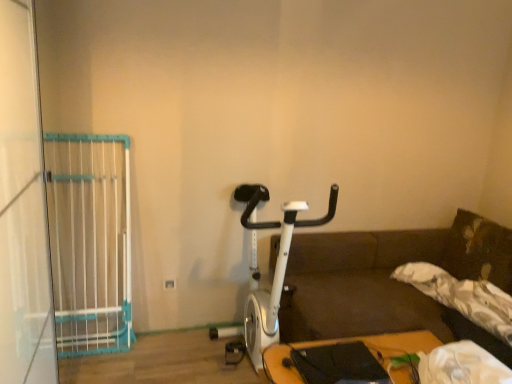
Identify the location of wooden table at lower right. This screenshot has width=512, height=384. (351, 342).

Describe the element at coordinates (90, 241) in the screenshot. I see `white plastic gate at left` at that location.

Identify the location of wooden table at lower right. The height and width of the screenshot is (384, 512). point(351,342).

Is wooden table at lower right to the left or to the right of white metallic stationary bicycle at center in the image?

wooden table at lower right is positioned on white metallic stationary bicycle at center's right side.

Is white metallic stationary bicycle at center completely or partially inside wooden table at lower right?

Definitely not — white metallic stationary bicycle at center is not inside wooden table at lower right.

From the image's perspective, is wooden table at lower right positioned above or below white metallic stationary bicycle at center?

wooden table at lower right is below white metallic stationary bicycle at center.

Between wooden table at lower right and white metallic stationary bicycle at center, which one has smaller width?

With smaller width is white metallic stationary bicycle at center.

Looking at this image, what's the angular difference between white plastic gate at left and white metallic stationary bicycle at center's facing directions?

white plastic gate at left and white metallic stationary bicycle at center are facing 0.925 degrees away from each other.

From a real-world perspective, is white plastic gate at left physically below white metallic stationary bicycle at center?

No, from a real-world perspective, white plastic gate at left is not below white metallic stationary bicycle at center.

Is white plastic gate at left oriented away from white metallic stationary bicycle at center?

No, white metallic stationary bicycle at center is not at the back of white plastic gate at left.

Is white plastic gate at left thinner than white metallic stationary bicycle at center?

Yes.

Does white plastic gate at left have a smaller size compared to wooden table at lower right?

No.

Is white plastic gate at left to the left or to the right of wooden table at lower right in the image?

white plastic gate at left is to the left of wooden table at lower right.

Does white plastic gate at left come behind wooden table at lower right?

No, the depth of white plastic gate at left is less than that of wooden table at lower right.

From a real-world perspective, is wooden table at lower right positioned over white plastic gate at left based on gravity?

No, from a real-world perspective, wooden table at lower right is not over white plastic gate at left

Between wooden table at lower right and white plastic gate at left, which one has larger width?

wooden table at lower right.

From the image's perspective, is wooden table at lower right above or below white plastic gate at left?

Based on their image positions, wooden table at lower right is located beneath white plastic gate at left.

Which is behind, wooden table at lower right or white plastic gate at left?

wooden table at lower right is further from the camera.

Could you tell me if white plastic gate at left is facing white plastic gate at left?

Yes, white plastic gate at left is oriented towards white plastic gate at left.

Which object is positioned more to the right, white plastic gate at left or white plastic gate at left?

From the viewer's perspective, white plastic gate at left appears more on the right side.

From the picture: From the image's perspective, is wooden table at lower right located above white plastic gate at left?

Incorrect, from the image's perspective, wooden table at lower right is lower than white plastic gate at left.

Relative to white plastic gate at left, is wooden table at lower right in front or behind?

Clearly, wooden table at lower right is in front of white plastic gate at left.

Considering the positions of point (421, 341) and point (66, 181), is point (421, 341) closer or farther from the camera than point (66, 181)?

Point (421, 341).

From a real-world perspective, which is physically below, white plastic gate at left or white metallic stationary bicycle at center?

In real-world perspective, white metallic stationary bicycle at center is lower.

Would you say white plastic gate at left is a long distance from white metallic stationary bicycle at center?

No, there isn't a large distance between white plastic gate at left and white metallic stationary bicycle at center.

Identify the location of stationary bicycle below the white plastic gate at left (from the image's perspective). The width and height of the screenshot is (512, 384). (275, 267).

Can you confirm if white plastic gate at left is bigger than white metallic stationary bicycle at center?

No.

Identify the location of furniture that is on the right side of white metallic stationary bicycle at center. The height and width of the screenshot is (384, 512). (351, 342).

Locate an element on the screen. Image resolution: width=512 pixels, height=384 pixels. cage on the left of white metallic stationary bicycle at center is located at coordinates (90, 241).

From the image, which object appears to be farther from white plastic gate at left, wooden table at lower right or white metallic stationary bicycle at center?

Among the two, wooden table at lower right is located further to white plastic gate at left.

Based on their spatial positions, is white plastic gate at left or wooden table at lower right closer to white plastic gate at left?

white plastic gate at left lies closer to white plastic gate at left than the other object.

When comparing their distances from white metallic stationary bicycle at center, does wooden table at lower right or white plastic gate at left seem further?

white plastic gate at left lies further to white metallic stationary bicycle at center than the other object.

Considering their positions, is wooden table at lower right positioned closer to white plastic gate at left than white plastic gate at left?

white plastic gate at left is positioned closer to the anchor white plastic gate at left.

Which object lies nearer to the anchor point white metallic stationary bicycle at center, white plastic gate at left or wooden table at lower right?

wooden table at lower right is closer to white metallic stationary bicycle at center.

Estimate the real-world distances between objects in this image. Which object is closer to white plastic gate at left, white plastic gate at left or white metallic stationary bicycle at center?

The object closer to white plastic gate at left is white plastic gate at left.

From the image, which object appears to be nearer to white plastic gate at left, white plastic gate at left or wooden table at lower right?

white plastic gate at left lies closer to white plastic gate at left than the other object.

Estimate the real-world distances between objects in this image. Which object is further from wooden table at lower right, white plastic gate at left or white metallic stationary bicycle at center?

white plastic gate at left is positioned further to the anchor wooden table at lower right.

Where is `cage between white plastic gate at left and wooden table at lower right from left to right`? The width and height of the screenshot is (512, 384). cage between white plastic gate at left and wooden table at lower right from left to right is located at coordinates (90, 241).

Where is `stationary bicycle between white plastic gate at left and wooden table at lower right in the horizontal direction`? Image resolution: width=512 pixels, height=384 pixels. stationary bicycle between white plastic gate at left and wooden table at lower right in the horizontal direction is located at coordinates (275, 267).

Identify the location of cage situated between white plastic gate at left and white metallic stationary bicycle at center from left to right. The image size is (512, 384). (90, 241).

You are a GUI agent. You are given a task and a screenshot of the screen. Output one action in this format:
    pyautogui.click(x=<x>, y=<y>)
    Task: Click on the stationary bicycle between white plastic gate at left and wooden table at lower right from left to right
    The height and width of the screenshot is (384, 512).
    Given the screenshot: What is the action you would take?
    pyautogui.click(x=275, y=267)